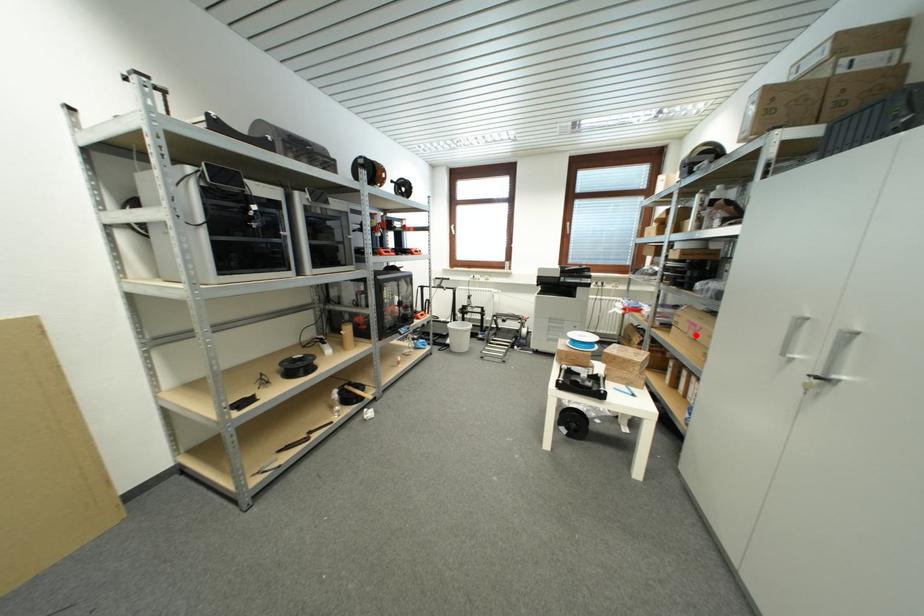
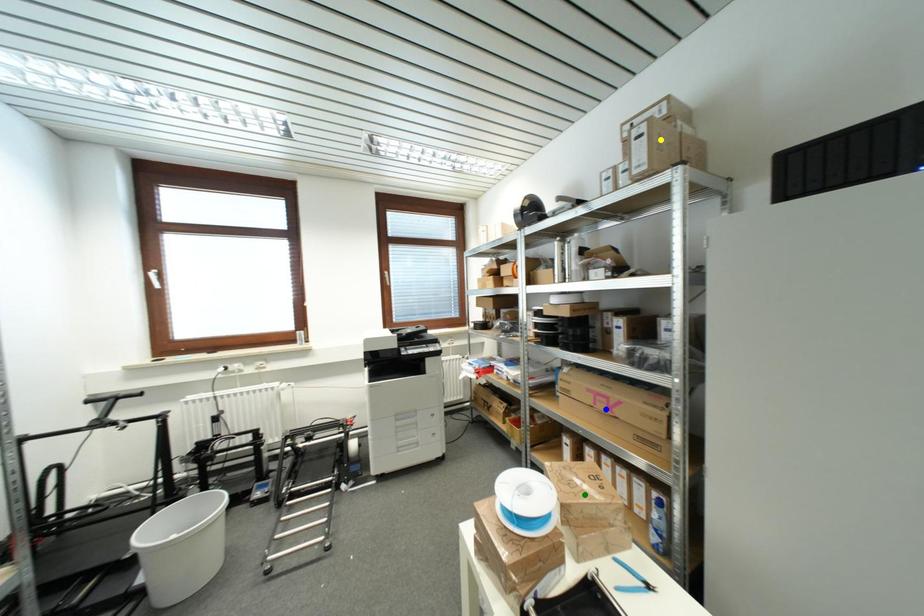
Question: I am providing you with two images of the same scene from different viewpoints. A red point is marked on the first image. You are given multiple points on the second image. Which spot in image 2 lines up with the point in image 1?

Choices:
 (A) blue point
 (B) yellow point
 (C) green point

Answer: (A)